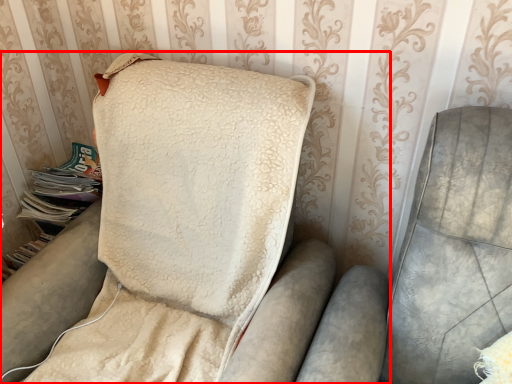
Question: From the image, what is the correct spatial relationship of furniture (annotated by the red box) in relation to magazine?

Choices:
 (A) left
 (B) right

Answer: (B)